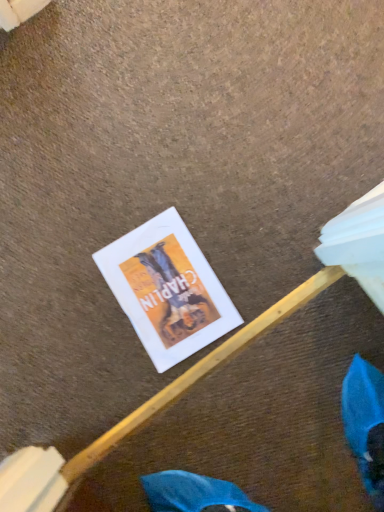
The image size is (384, 512). What do you see at coordinates (167, 289) in the screenshot?
I see `white paper book at center` at bounding box center [167, 289].

You are a GUI agent. You are given a task and a screenshot of the screen. Output one action in this format:
    pyautogui.click(x=<x>, y=<y>)
    Task: Click on the white paper book at center
    
    Given the screenshot: What is the action you would take?
    pyautogui.click(x=167, y=289)

The height and width of the screenshot is (512, 384). I want to click on white paper book at center, so click(167, 289).